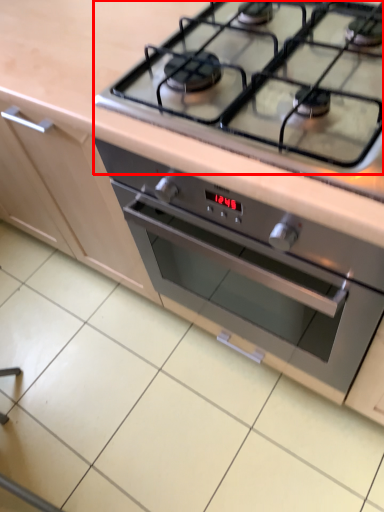
Question: From the image's perspective, considering the relative positions of gas stove (annotated by the red box) and oven in the image provided, where is gas stove (annotated by the red box) located with respect to the staircase?

Choices:
 (A) above
 (B) below

Answer: (A)